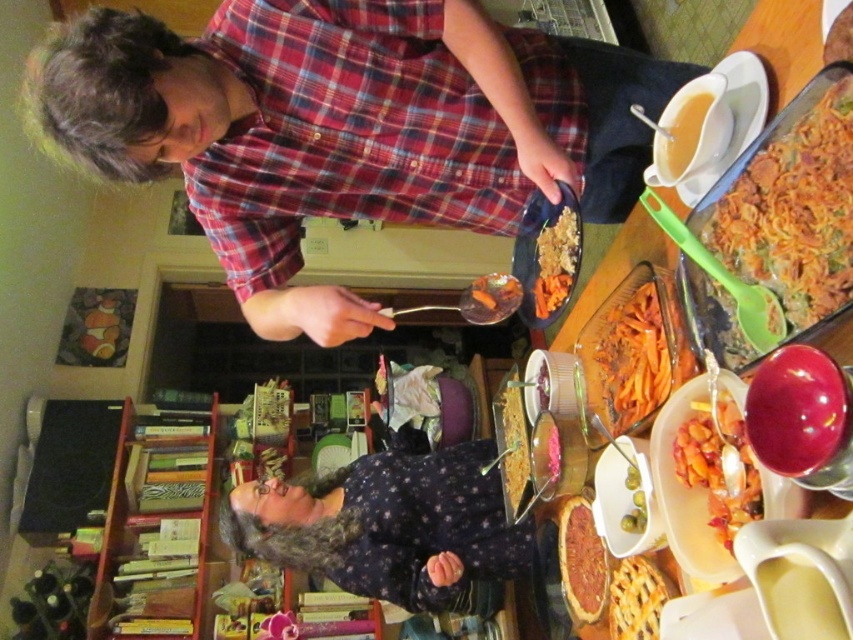
Question: In this image, where is carrot orange pasta at right located relative to yellow creamy gravy at upper right?

Choices:
 (A) below
 (B) above

Answer: (A)

Question: Does carrot orange pasta at right appear on the left side of wooden bookshelf at lower left?

Choices:
 (A) yes
 (B) no

Answer: (B)

Question: Which point appears closest to the camera in this image?

Choices:
 (A) (641, 620)
 (B) (583, 548)
 (C) (718, 499)

Answer: (C)

Question: Which of these objects is positioned closest to the dark blue floral sweater at lower center?

Choices:
 (A) plaid shirt at upper center
 (B) yellow creamy sauce at lower right
 (C) translucent glass gravy boat at upper right

Answer: (C)

Question: Which object is positioned closest to the shiny orange pasta at center?

Choices:
 (A) orange matte pasta at center
 (B) yellow creamy sauce at lower right
 (C) wooden bookshelf at lower left
 (D) yellow creamy gravy at upper right

Answer: (A)

Question: Does smooth brown pie at center have a smaller size compared to yellow creamy gravy at upper right?

Choices:
 (A) yes
 (B) no

Answer: (B)